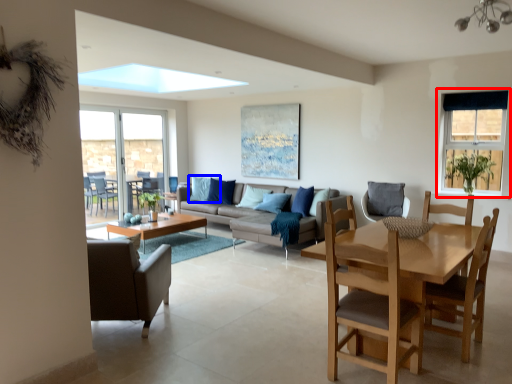
Question: Among these objects, which one is farthest to the camera, window (highlighted by a red box) or pillow (highlighted by a blue box)?

Choices:
 (A) window
 (B) pillow

Answer: (B)